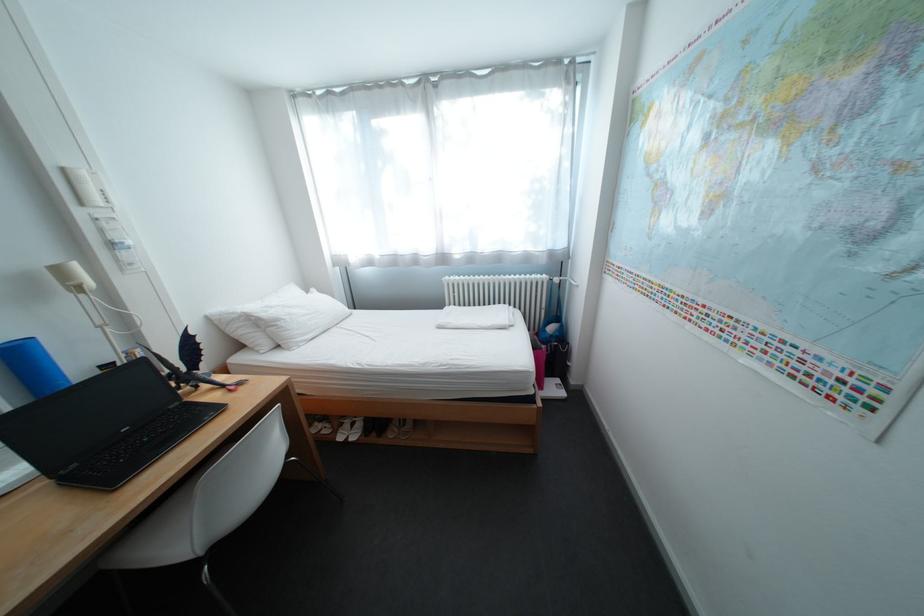
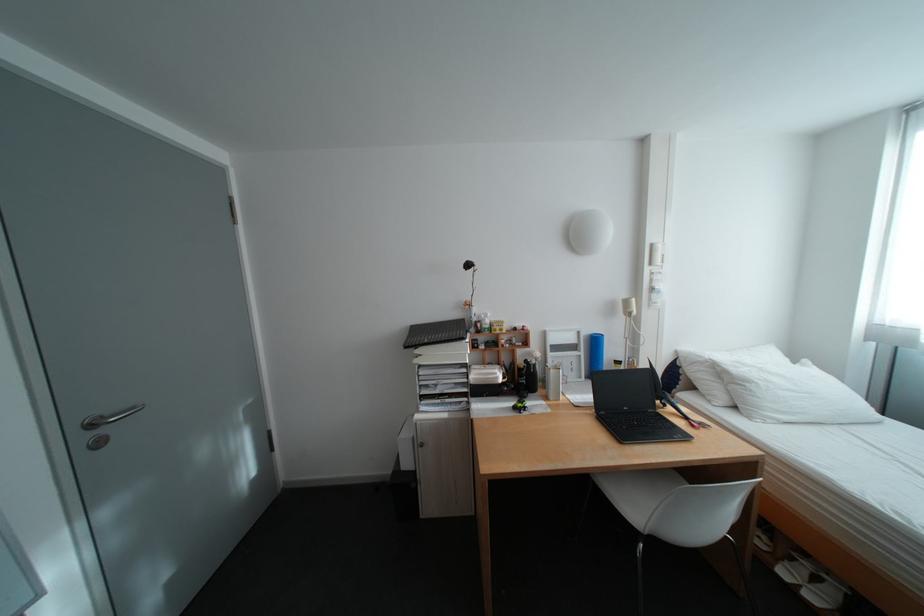
The point at (76, 171) is marked in the first image. Where is the corresponding point in the second image?

(664, 246)